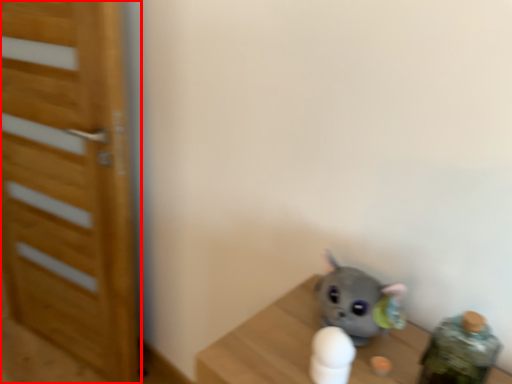
Question: Where is door (annotated by the red box) located in relation to toy in the image?

Choices:
 (A) right
 (B) left

Answer: (B)